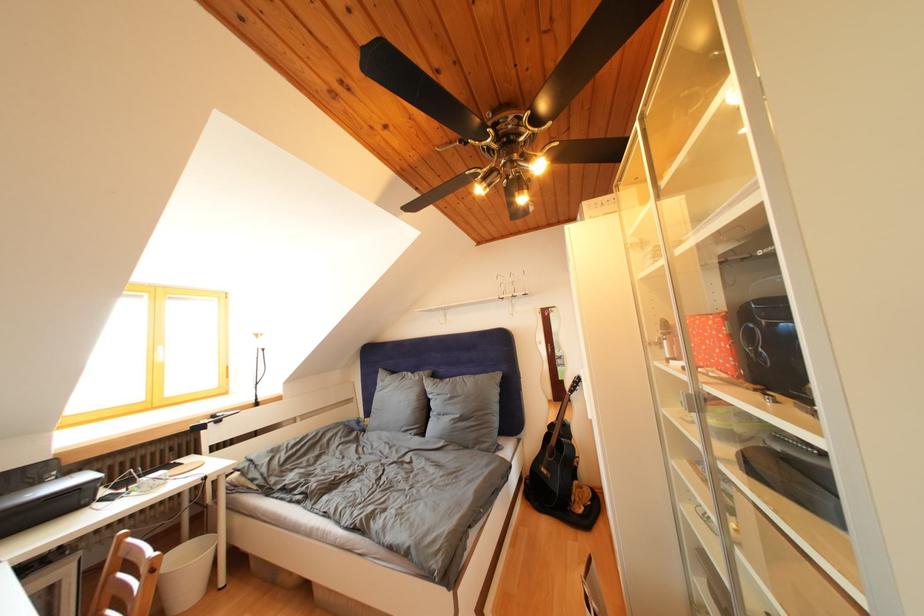
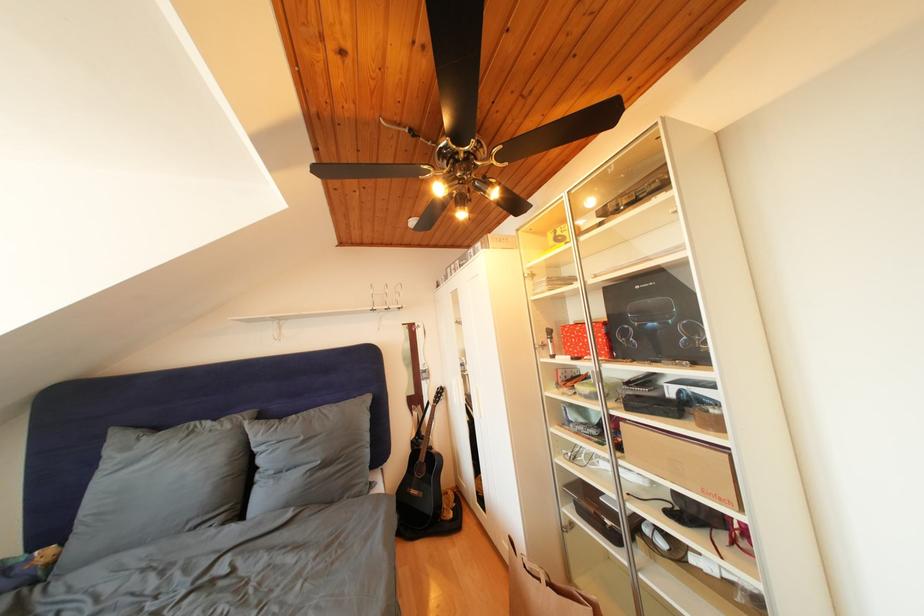
Where in the second image is the point corresponding to pixel 457 400 from the first image?

(310, 444)